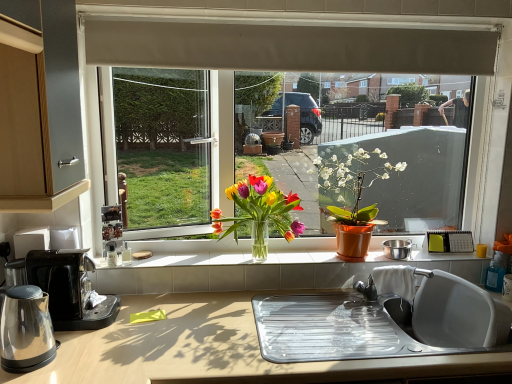
Locate an element on the screen. vacant space to the left of yellow plastic corded phone at right is located at coordinates (416, 253).